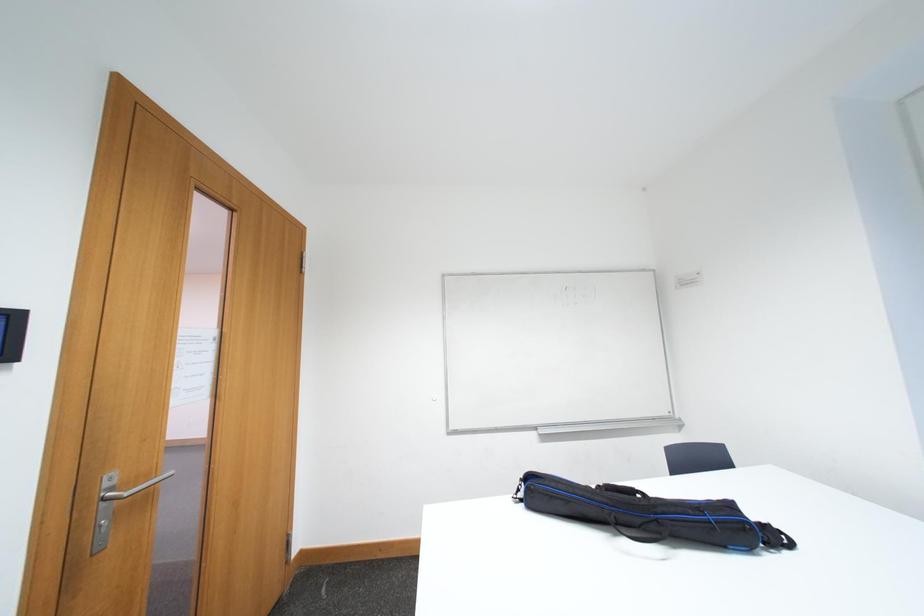
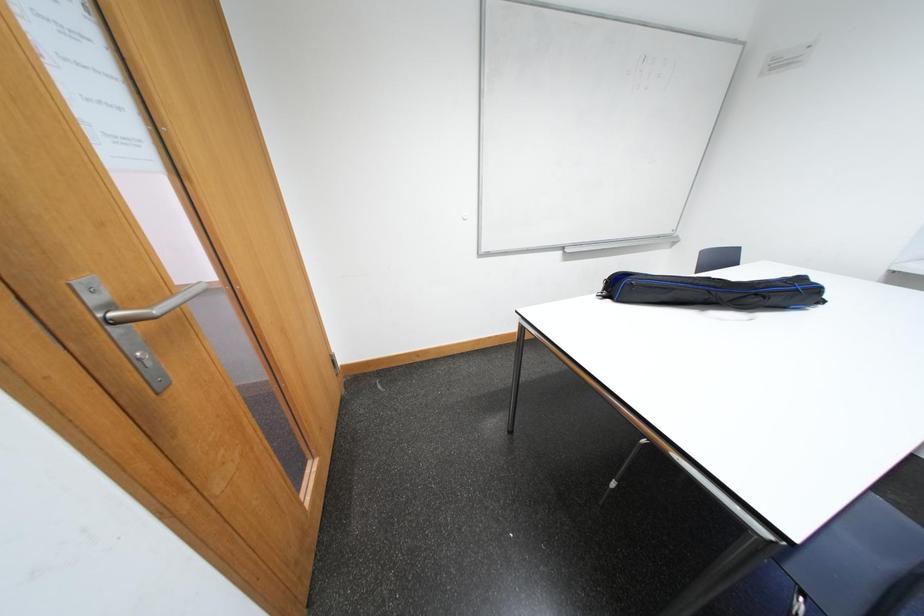
The first image is from the beginning of the video and the second image is from the end. How did the camera likely rotate when shooting the video?

The rotation direction of the camera is right-down.